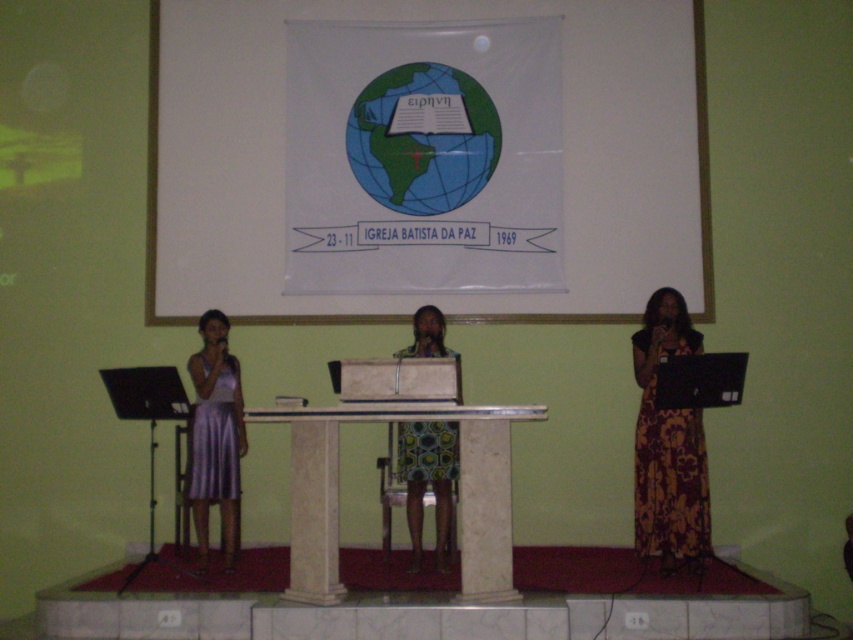
Question: Can you confirm if brown floral dress at right is wider than silvery satin dress at left?

Choices:
 (A) no
 (B) yes

Answer: (B)

Question: Which object appears closest to the camera in this image?

Choices:
 (A) white marble table at center
 (B) printed fabric dress at center

Answer: (A)

Question: Which of the following is the farthest from the observer?

Choices:
 (A) brown floral dress at right
 (B) silvery satin dress at left
 (C) white fabric at center

Answer: (C)

Question: Does white fabric at center appear on the left side of white marble table at center?

Choices:
 (A) yes
 (B) no

Answer: (A)

Question: Does silvery satin dress at left have a larger size compared to printed fabric dress at center?

Choices:
 (A) no
 (B) yes

Answer: (B)

Question: Which object is the closest to the brown floral dress at right?

Choices:
 (A) white marble table at center
 (B) printed fabric dress at center

Answer: (B)